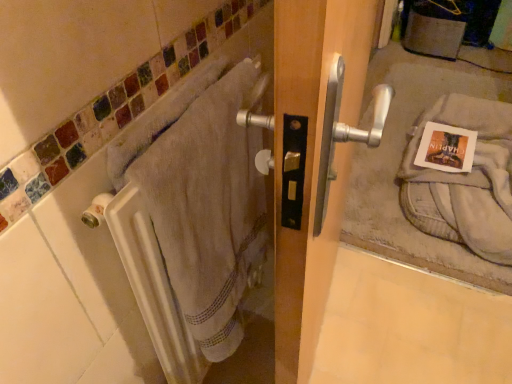
Question: Is matte paper postcard at door handle directly adjacent to gray cotton towel at lower right, the 1th bath towel from the back?

Choices:
 (A) yes
 (B) no

Answer: (B)

Question: Does matte paper postcard at door handle have a greater height compared to gray cotton towel at lower right, placed as the 2th bath towel when sorted from left to right?

Choices:
 (A) yes
 (B) no

Answer: (B)

Question: Can you confirm if matte paper postcard at door handle is wider than gray cotton towel at lower right, which is the 2th bath towel from front to back?

Choices:
 (A) no
 (B) yes

Answer: (A)

Question: Is matte paper postcard at door handle bigger than gray cotton towel at lower right, placed as the 2th bath towel when sorted from left to right?

Choices:
 (A) yes
 (B) no

Answer: (B)

Question: Is matte paper postcard at door handle not near gray cotton towel at lower right, the 1th bath towel from the back?

Choices:
 (A) yes
 (B) no

Answer: (B)

Question: Is matte paper postcard at door handle oriented away from gray cotton towel at lower right, placed as the 2th bath towel when sorted from left to right?

Choices:
 (A) no
 (B) yes

Answer: (B)

Question: From the image's perspective, does beige cotton towel at left, arranged as the first bath towel when viewed from the left, appear lower than matte paper postcard at door handle?

Choices:
 (A) yes
 (B) no

Answer: (A)

Question: Does beige cotton towel at left, arranged as the first bath towel when viewed from the left, come in front of matte paper postcard at door handle?

Choices:
 (A) yes
 (B) no

Answer: (A)

Question: Can you confirm if beige cotton towel at left, acting as the second bath towel starting from the right, is taller than matte paper postcard at door handle?

Choices:
 (A) yes
 (B) no

Answer: (A)

Question: From the image's perspective, does beige cotton towel at left, marked as the second bath towel in a back-to-front arrangement, appear higher than matte paper postcard at door handle?

Choices:
 (A) no
 (B) yes

Answer: (A)

Question: Is beige cotton towel at left, which is the first bath towel from front to back, smaller than matte paper postcard at door handle?

Choices:
 (A) yes
 (B) no

Answer: (B)

Question: Considering the relative positions of beige cotton towel at left, acting as the second bath towel starting from the right, and matte paper postcard at door handle in the image provided, is beige cotton towel at left, acting as the second bath towel starting from the right, to the left of matte paper postcard at door handle from the viewer's perspective?

Choices:
 (A) yes
 (B) no

Answer: (A)

Question: Can you confirm if beige cotton towel at left, marked as the second bath towel in a back-to-front arrangement, is shorter than white towel at left?

Choices:
 (A) no
 (B) yes

Answer: (B)